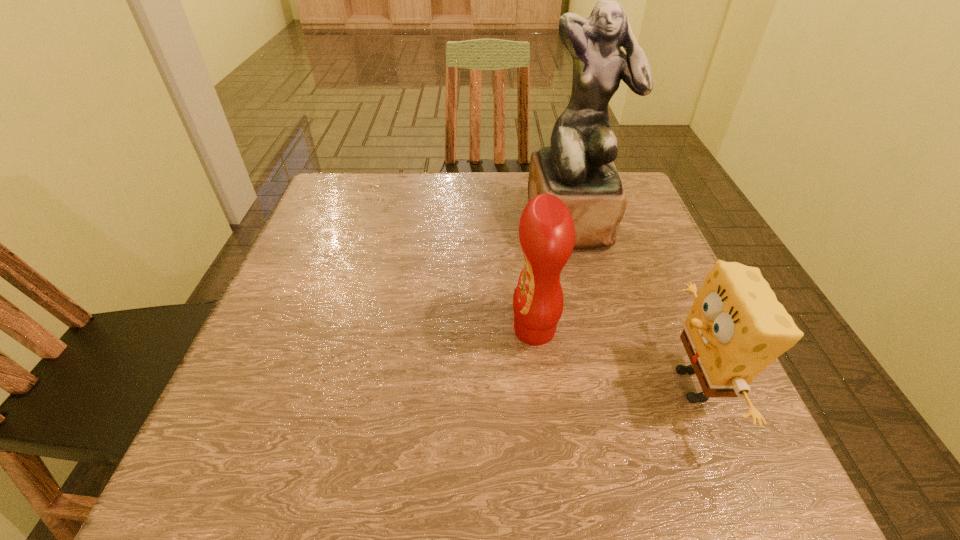
Identify the location of the farthest object. This screenshot has width=960, height=540. (577, 167).

Locate an element on the screen. the tallest object is located at coordinates (577, 167).

Find the location of `the second tallest object`. the second tallest object is located at coordinates point(546,230).

Identify the location of the shortest object. The height and width of the screenshot is (540, 960). (736, 327).

Locate an element on the screen. This screenshot has width=960, height=540. vacant area located 0.340m in a relaxed pose on the sculpture is located at coordinates (614, 385).

I want to click on vacant space located 0.080m on the label side of the second shortest object, so click(x=468, y=330).

Where is `vacant space situated on the label side of the second shortest object`? vacant space situated on the label side of the second shortest object is located at coordinates (436, 330).

This screenshot has width=960, height=540. Identify the location of free space located 0.390m on the label side of the second shortest object. (301, 330).

Identify the location of vacant space positioned on the face of the shortest object. The image size is (960, 540). (450, 385).

Identify the location of free spot located 0.260m on the face of the shortest object. pyautogui.click(x=505, y=385).